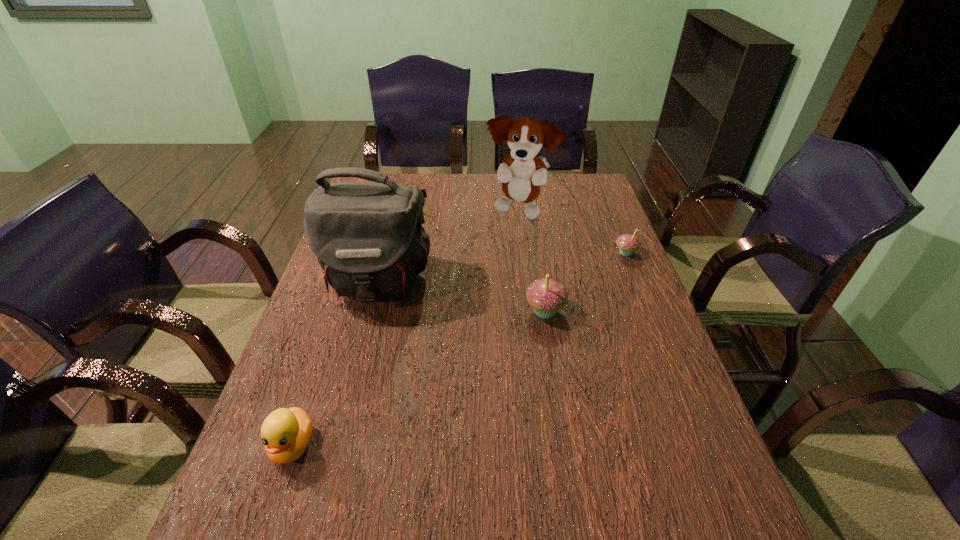
Where is `object present at the far left corner`? object present at the far left corner is located at coordinates (438, 210).

You are a GUI agent. You are given a task and a screenshot of the screen. Output one action in this format:
    pyautogui.click(x=<x>, y=<y>)
    Task: Click on the object that is positioned at the near left corner
    The image size is (960, 540).
    Given the screenshot: What is the action you would take?
    pyautogui.click(x=286, y=433)

In the image, there is a desktop. Where is `vacant space at the far edge`? The height and width of the screenshot is (540, 960). vacant space at the far edge is located at coordinates (556, 183).

The image size is (960, 540). Identify the location of free region at the left edge of the desktop. (273, 392).

Find the location of a particular element. This screenshot has width=960, height=540. free spot at the right edge of the desktop is located at coordinates (630, 305).

This screenshot has height=540, width=960. In the image, there is a desktop. Find the location of `free space at the near left corner`. free space at the near left corner is located at coordinates (301, 475).

At what (x,y) coordinates should I click in order to perform the action: click on unoccupied position between the puppy and the pocket watch. Please return your answer as a coordinate pair (x, y). The width and height of the screenshot is (960, 540). Looking at the image, I should click on (468, 213).

At what (x,y) coordinates should I click in order to perform the action: click on vacant space in between the nearer cupcake and the puppy. Please return your answer as a coordinate pair (x, y). This screenshot has height=540, width=960. Looking at the image, I should click on tap(533, 261).

What are the coordinates of `vacant area that lies between the shoulder bag and the puppy` in the screenshot? It's located at coord(448,247).

The width and height of the screenshot is (960, 540). I want to click on vacant point located between the right cupcake and the left cupcake, so click(586, 282).